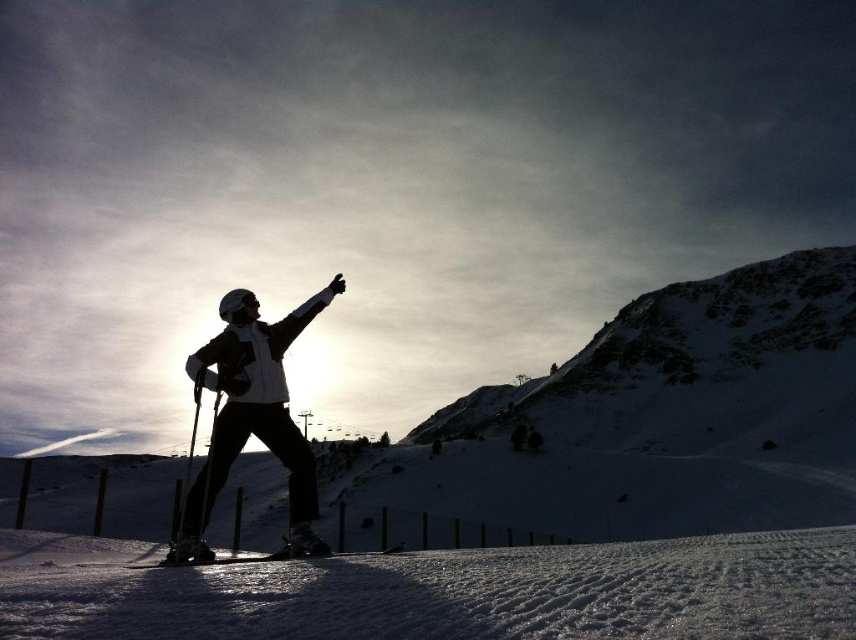
You are a photographer planning to capture a sunset shot of the skier and the snowy slope. The point at coordinates (455, 593) marks the location of white snow at lower center. Where should you position yourself relative to the skier to ensure the white snow at lower center is fully visible in the frame?

Position yourself behind the skier so that the white snow at lower center remains visible in the frame.

You are a photographer trying to capture the skier and the snow in the scene. Since both the white snow at lower center and the matte white jacket at center are white, how can you tell them apart based on their positions?

The white snow at lower center is to the right of the matte white jacket at center, so you can distinguish them by their relative positions.

You are a drone operator tasked with capturing aerial footage of the scene. The drone must fly from the white snow at lower center to the shiny metallic ski at center. Given that the drone has a maximum flight range of 15 meters, will it be able to complete this mission without needing to recharge?

The distance between the white snow at lower center and the shiny metallic ski at center is 14.30 meters, which is within the drone operator drone has a maximum flight range of 15 meters. Therefore, the drone can complete the mission without needing to recharge.